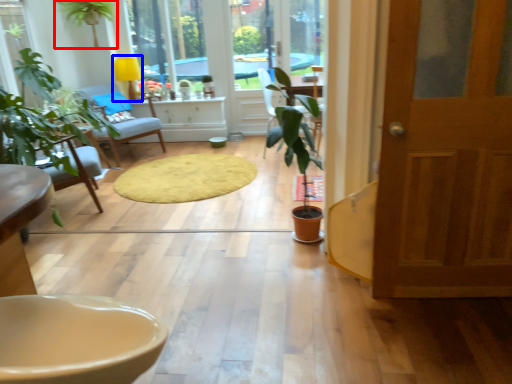
Question: Which object appears closest to the camera in this image, houseplant (highlighted by a red box) or lamp (highlighted by a blue box)?

Choices:
 (A) houseplant
 (B) lamp

Answer: (A)